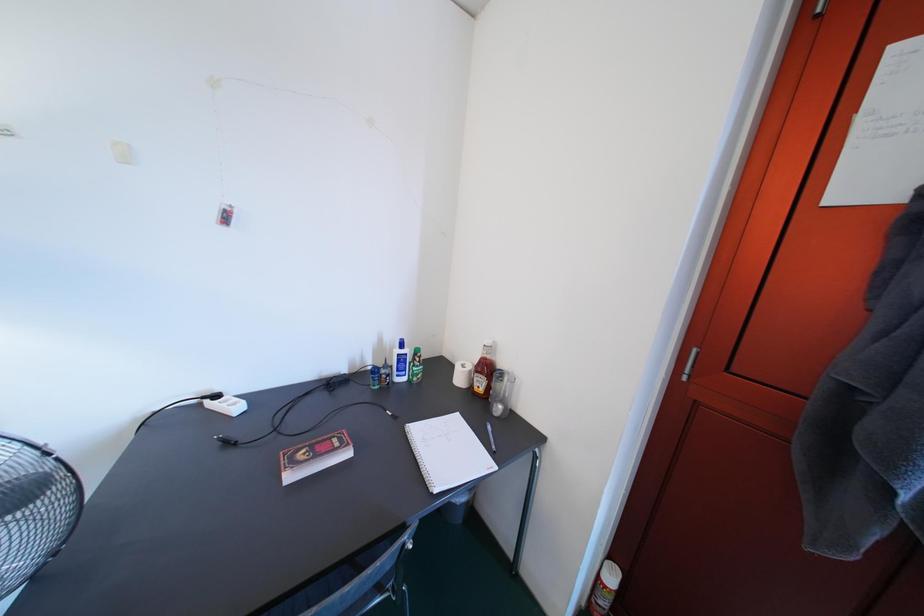
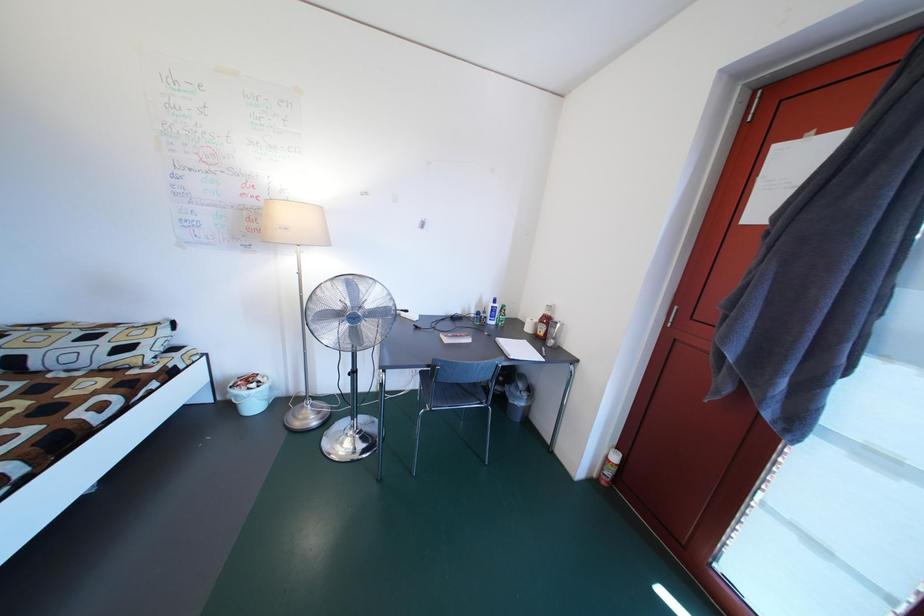
Question: The images are taken continuously from a first-person perspective. In which direction is your viewpoint rotating?

Choices:
 (A) Left
 (B) Right
 (C) Up
 (D) Down

Answer: (A)